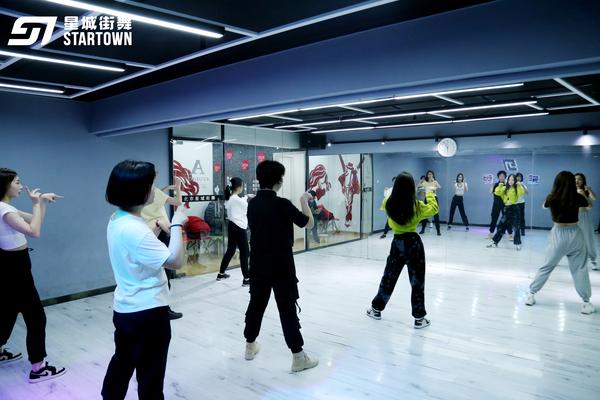
Where is `wall paintings`? Image resolution: width=600 pixels, height=400 pixels. wall paintings is located at coordinates (180, 170), (320, 177), (353, 179).